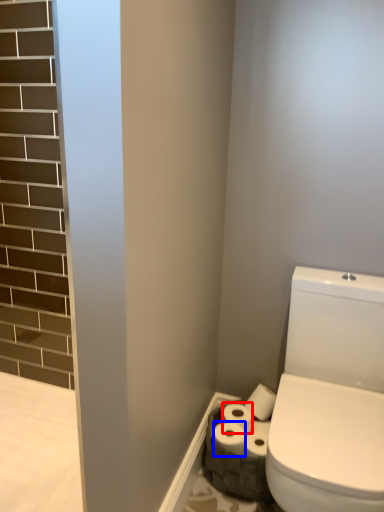
Question: Which of the following is the closest to the observer, toilet paper (highlighted by a red box) or toilet paper (highlighted by a blue box)?

Choices:
 (A) toilet paper
 (B) toilet paper

Answer: (B)